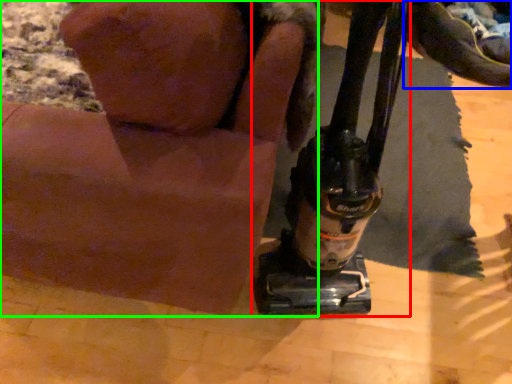
Question: Considering the real-world distances, which object is closest to sewing machine (highlighted by a red box)? footwear (highlighted by a blue box) or animal (highlighted by a green box).

Choices:
 (A) footwear
 (B) animal

Answer: (B)